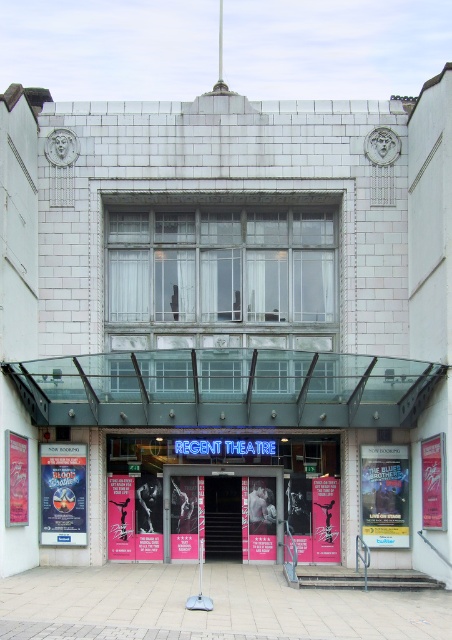
Question: Which object is closer to the camera taking this photo?

Choices:
 (A) pink glossy posters at center
 (B) pink poster at center
 (C) metallic blue poster at center
 (D) blue glossy poster at center

Answer: (C)

Question: Which of these objects is positioned farthest from the pink glossy posters at center?

Choices:
 (A) metallic blue poster at center
 (B) blue glossy poster at center

Answer: (A)

Question: Considering the real-world distances, which object is farthest from the pink glossy posters at center?

Choices:
 (A) blue glossy poster at center
 (B) metallic blue poster at center

Answer: (B)

Question: Does blue glossy poster at center appear under pink poster at center?

Choices:
 (A) no
 (B) yes

Answer: (A)

Question: Considering the relative positions of pink glossy posters at center and blue glossy poster at center in the image provided, where is pink glossy posters at center located with respect to blue glossy poster at center?

Choices:
 (A) right
 (B) left

Answer: (A)

Question: Is pink glossy posters at center below blue glossy poster at center?

Choices:
 (A) no
 (B) yes

Answer: (B)